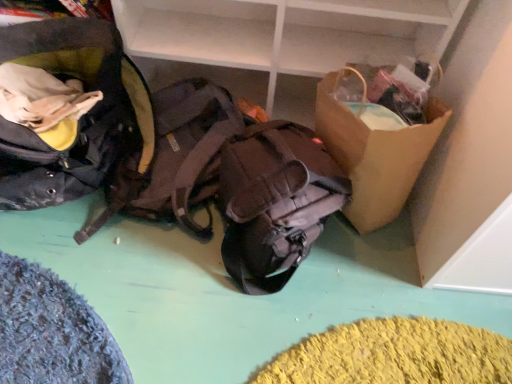
Question: From a real-world perspective, is matte brown backpack at center, the 1th backpack viewed from the right, physically above brown paper bag at right?

Choices:
 (A) yes
 (B) no

Answer: (B)

Question: Is matte brown backpack at center, the third backpack in the left-to-right sequence, far away from brown paper bag at right?

Choices:
 (A) no
 (B) yes

Answer: (A)

Question: Can you confirm if matte brown backpack at center, the 1th backpack viewed from the right, is shorter than brown paper bag at right?

Choices:
 (A) no
 (B) yes

Answer: (B)

Question: Does matte brown backpack at center, the third backpack in the left-to-right sequence, come behind brown paper bag at right?

Choices:
 (A) yes
 (B) no

Answer: (B)

Question: From the image's perspective, is matte brown backpack at center, the 1th backpack viewed from the right, below brown paper bag at right?

Choices:
 (A) yes
 (B) no

Answer: (A)

Question: Considering the relative positions of matte black backpack at left, positioned as the 3th backpack in right-to-left order, and brown fabric backpack at center, which is the 2th backpack in left-to-right order, in the image provided, is matte black backpack at left, positioned as the 3th backpack in right-to-left order, to the left or to the right of brown fabric backpack at center, which is the 2th backpack in left-to-right order,?

Choices:
 (A) left
 (B) right

Answer: (A)

Question: Is matte black backpack at left, positioned as the 3th backpack in right-to-left order, bigger or smaller than brown fabric backpack at center, which is the 2th backpack in left-to-right order?

Choices:
 (A) small
 (B) big

Answer: (B)

Question: From the image's perspective, is matte black backpack at left, positioned as the 3th backpack in right-to-left order, located above or below brown fabric backpack at center, positioned as the 2th backpack in right-to-left order?

Choices:
 (A) below
 (B) above

Answer: (B)

Question: Is matte black backpack at left, positioned as the 3th backpack in right-to-left order, inside or outside of brown fabric backpack at center, positioned as the 2th backpack in right-to-left order?

Choices:
 (A) outside
 (B) inside

Answer: (A)

Question: Is brown paper bag at right wider or thinner than matte brown backpack at center, the 1th backpack viewed from the right?

Choices:
 (A) wide
 (B) thin

Answer: (A)

Question: Is point (331, 74) closer or farther from the camera than point (280, 183)?

Choices:
 (A) closer
 (B) farther

Answer: (B)

Question: Is brown paper bag at right situated inside matte brown backpack at center, the third backpack in the left-to-right sequence, or outside?

Choices:
 (A) inside
 (B) outside

Answer: (B)

Question: Is brown paper bag at right in front of or behind matte brown backpack at center, the third backpack in the left-to-right sequence, in the image?

Choices:
 (A) front
 (B) behind

Answer: (B)

Question: Would you say brown fabric backpack at center, which is the 2th backpack in left-to-right order, is inside or outside matte black backpack at left, placed as the first backpack when sorted from left to right?

Choices:
 (A) inside
 (B) outside

Answer: (B)

Question: Relative to matte black backpack at left, placed as the first backpack when sorted from left to right, is brown fabric backpack at center, positioned as the 2th backpack in right-to-left order, in front or behind?

Choices:
 (A) front
 (B) behind

Answer: (B)